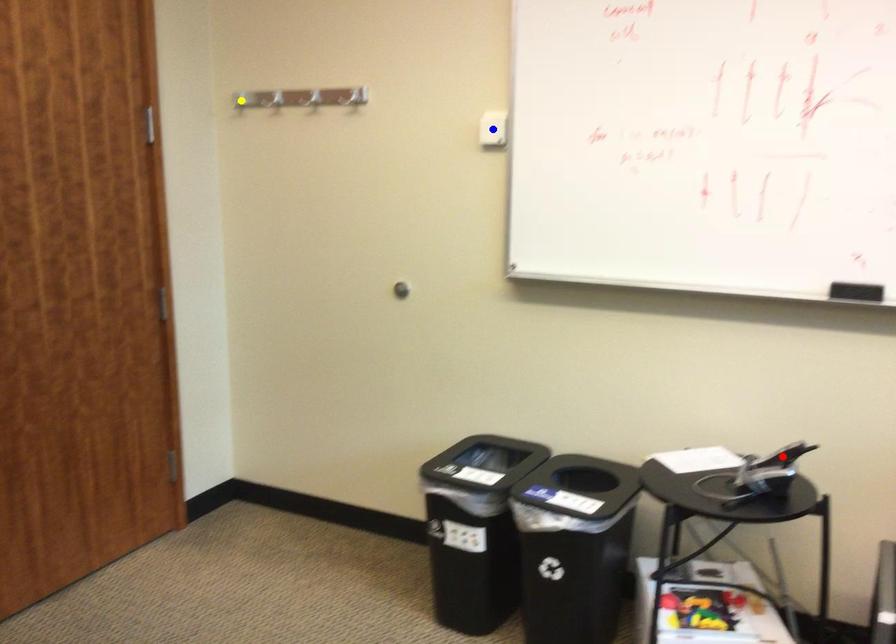
Order these from farthest to nearest:
A) blue point
B) red point
C) yellow point

1. yellow point
2. blue point
3. red point